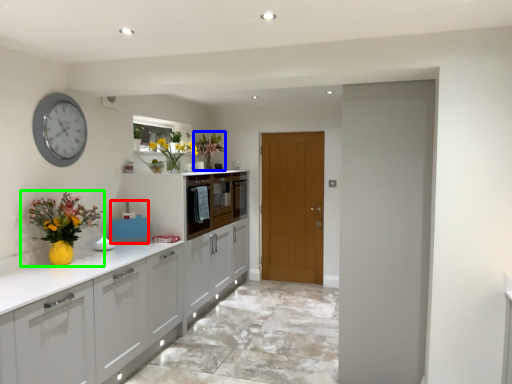
Question: Which object is positioned closest to appliance (highlighted by a red box)? Select from floral arrangement (highlighted by a blue box) and floral arrangement (highlighted by a green box).

Choices:
 (A) floral arrangement
 (B) floral arrangement

Answer: (B)